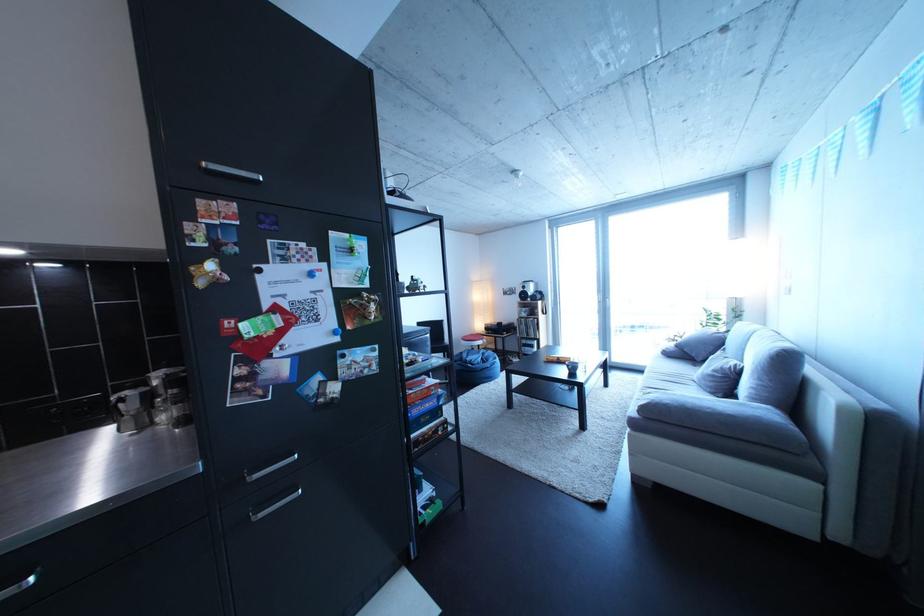
The image size is (924, 616). What do you see at coordinates (756, 373) in the screenshot?
I see `a sofa sitting surface` at bounding box center [756, 373].